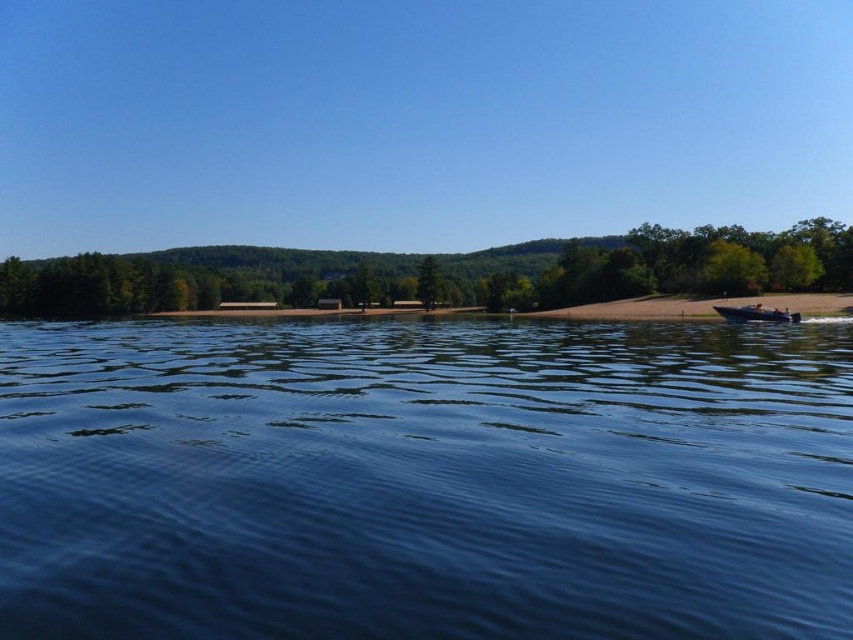
You are standing at the lakeside and want to estimate how far the green leafy tree at center is from you. Can you determine the distance based on the scene?

The green leafy tree at center is 79.24 meters away from the viewer.

You are standing on the sandy beach and want to reach both the point at coordinates [432,541] and the point at coordinates [134,289]. Which point should you head towards first if you want to reach the one closer to you first?

You should head towards point [432,541] first because it is closer to you than point [134,289].

You are standing at the point marked by the coordinates (653, 266) in the image. Looking around, you see a green leafy tree at center. Can you determine which direction the green leafy tree at center is located relative to your position?

The green leafy tree at center is located at the point marked by the coordinates (653, 266), so you are standing right at the base of the tree.